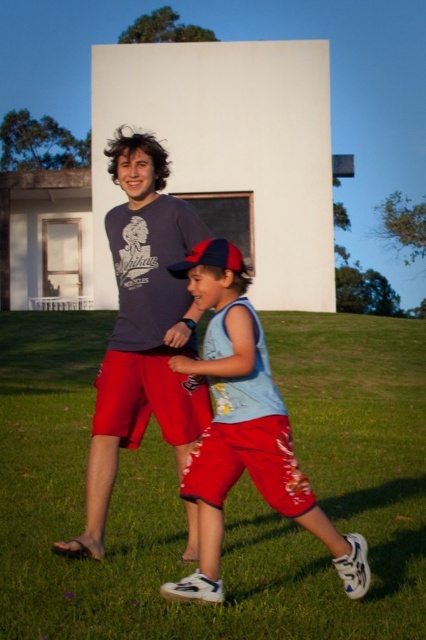
Question: Which point is farther to the camera?

Choices:
 (A) (175, 365)
 (B) (201, 257)

Answer: (B)

Question: Which of these objects is positioned closest to the matte blue tank top at center?

Choices:
 (A) matte blue t-shirt at center
 (B) red fabric baseball cap at center

Answer: (A)

Question: Can you confirm if matte blue t-shirt at center is positioned to the left of red fabric baseball cap at center?

Choices:
 (A) yes
 (B) no

Answer: (A)

Question: Considering the relative positions of green grass at center and matte blue tank top at center in the image provided, where is green grass at center located with respect to matte blue tank top at center?

Choices:
 (A) left
 (B) right

Answer: (A)

Question: Does green grass at center have a larger size compared to red fabric baseball cap at center?

Choices:
 (A) no
 (B) yes

Answer: (B)

Question: Which object appears farthest from the camera in this image?

Choices:
 (A) matte blue t-shirt at center
 (B) green grass at center
 (C) red fabric baseball cap at center

Answer: (A)